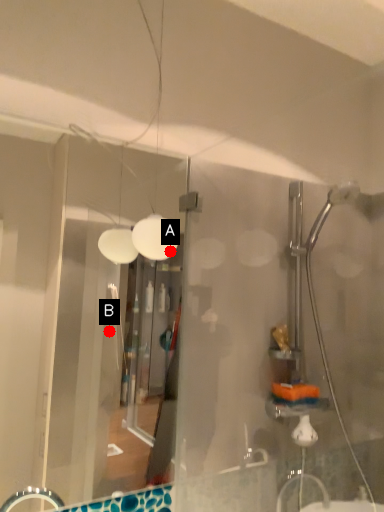
Question: Two points are circled on the image, labeled by A and B beside each circle. Which point appears closest to the camera in this image?

Choices:
 (A) A is closer
 (B) B is closer

Answer: (A)